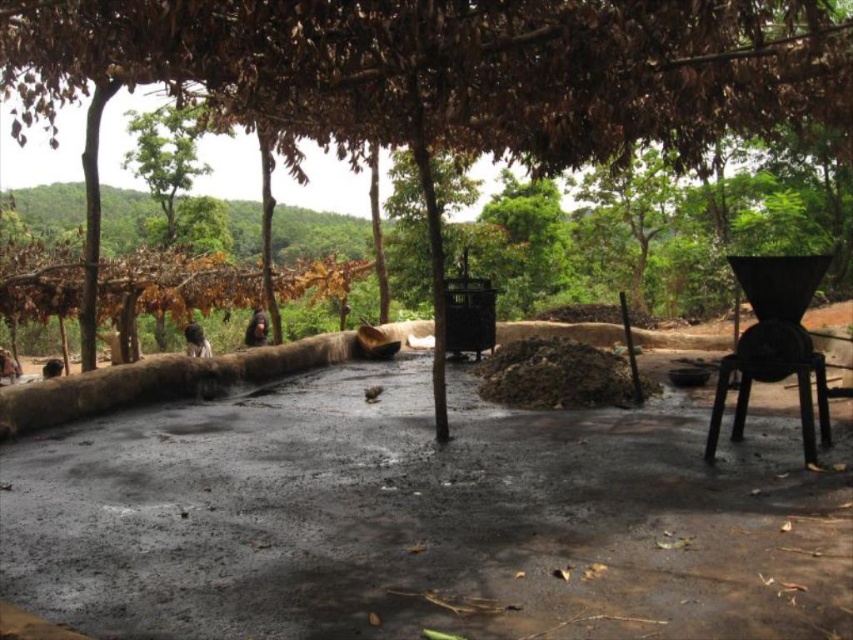
Can you confirm if brown leafy tree at center is smaller than green leafy tree at upper left?

Yes.

Is point (300, 44) more distant than point (167, 141)?

No, it is not.

This screenshot has width=853, height=640. Identify the location of brown leafy tree at center. (436, 72).

Is point (456, 74) farther from viewer compared to point (801, 396)?

Yes, it is.

Which is more to the right, brown leafy tree at center or black plastic stool at lower right?

From the viewer's perspective, black plastic stool at lower right appears more on the right side.

This screenshot has height=640, width=853. I want to click on brown leafy tree at center, so click(436, 72).

Does green leafy tree at upper left appear on the right side of black plastic stool at lower right?

No, green leafy tree at upper left is not to the right of black plastic stool at lower right.

Is point (190, 225) positioned before point (827, 426)?

That is False.

Where is `green leafy tree at upper left`? green leafy tree at upper left is located at coordinates (173, 170).

The image size is (853, 640). What are the coordinates of `green leafy tree at upper left` in the screenshot? It's located at (173, 170).